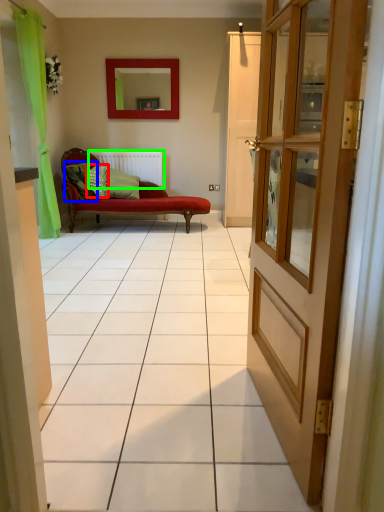
Question: Which is farther away from pillow (highlighted by a red box)? pillow (highlighted by a blue box) or radiator (highlighted by a green box)?

Choices:
 (A) pillow
 (B) radiator

Answer: (B)